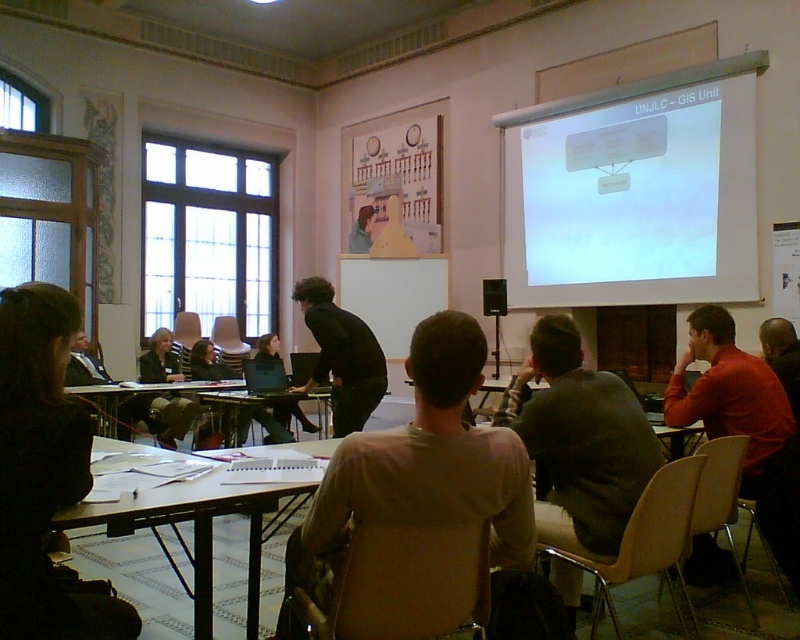
Can you confirm if white plastic table at center is taller than smooth beige shirt at center?

Incorrect, white plastic table at center's height is not larger of smooth beige shirt at center's.

Is white plastic table at center positioned at the back of smooth beige shirt at center?

That is False.

Identify the location of white plastic table at center. (262, 408).

Who is lower down, white matte projector screen at upper right or dark brown hair at right?

dark brown hair at right is below.

Where is `white matte projector screen at upper right`? This screenshot has width=800, height=640. white matte projector screen at upper right is located at coordinates (633, 193).

At what (x,y) coordinates should I click in order to perform the action: click on white matte projector screen at upper right. Please return your answer as a coordinate pair (x, y). The image size is (800, 640). Looking at the image, I should click on (633, 193).

Does white paper at lower center have a greater width compared to black matte/black suit at center?

Yes, white paper at lower center is wider than black matte/black suit at center.

What do you see at coordinates (197, 531) in the screenshot? The width and height of the screenshot is (800, 640). I see `white paper at lower center` at bounding box center [197, 531].

This screenshot has height=640, width=800. What do you see at coordinates (197, 531) in the screenshot?
I see `white paper at lower center` at bounding box center [197, 531].

Find the location of a particular element. white paper at lower center is located at coordinates (197, 531).